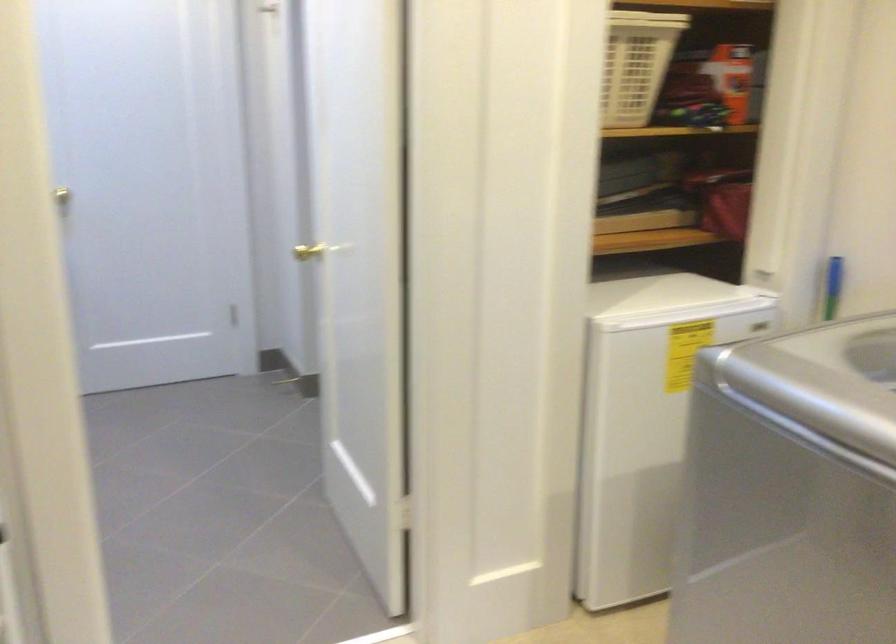
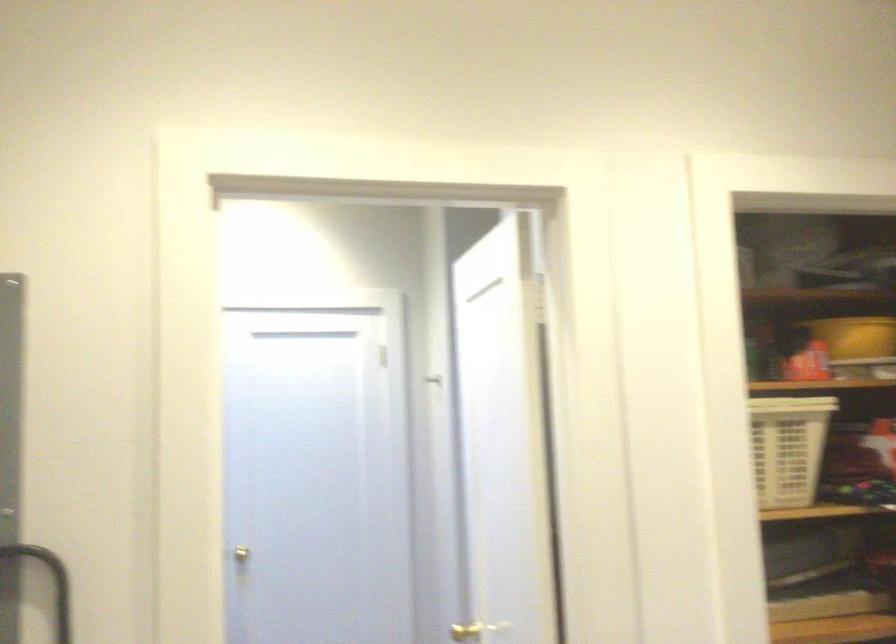
In the second image, find the point that corresponds to (80,190) in the first image.

(253, 553)